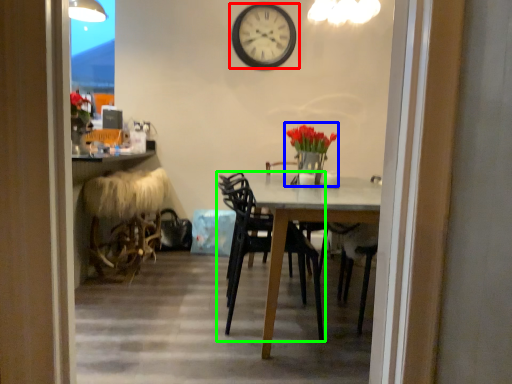
Question: Which object is positioned closest to wall clock (highlighted by a red box)? Select from floral arrangement (highlighted by a blue box) and chair (highlighted by a green box).

Choices:
 (A) floral arrangement
 (B) chair

Answer: (A)